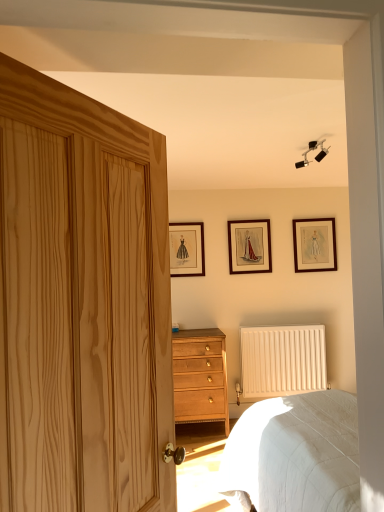
Question: Is natural wood door at left not inside white matte radiator at lower center?

Choices:
 (A) yes
 (B) no

Answer: (A)

Question: Does natural wood door at left have a greater width compared to white matte radiator at lower center?

Choices:
 (A) no
 (B) yes

Answer: (B)

Question: Is natural wood door at left at the right side of white matte radiator at lower center?

Choices:
 (A) yes
 (B) no

Answer: (B)

Question: Is natural wood door at left at the left side of white matte radiator at lower center?

Choices:
 (A) yes
 (B) no

Answer: (A)

Question: Is natural wood door at left further to camera compared to white matte radiator at lower center?

Choices:
 (A) no
 (B) yes

Answer: (A)

Question: From the image's perspective, is natural wood door at left on top of white matte radiator at lower center?

Choices:
 (A) no
 (B) yes

Answer: (B)

Question: Is wooden picture frame at upper right, the third picture frame from the left, closer to camera compared to black matte track light at upper center?

Choices:
 (A) yes
 (B) no

Answer: (B)

Question: Considering the relative sizes of wooden picture frame at upper right, the first picture frame from the right, and black matte track light at upper center in the image provided, is wooden picture frame at upper right, the first picture frame from the right, bigger than black matte track light at upper center?

Choices:
 (A) yes
 (B) no

Answer: (A)

Question: Does wooden picture frame at upper right, the third picture frame from the left, turn towards black matte track light at upper center?

Choices:
 (A) no
 (B) yes

Answer: (B)

Question: Is wooden picture frame at upper right, the third picture frame from the left, facing away from black matte track light at upper center?

Choices:
 (A) no
 (B) yes

Answer: (A)

Question: Are wooden picture frame at upper right, the first picture frame from the right, and black matte track light at upper center located far from each other?

Choices:
 (A) yes
 (B) no

Answer: (A)

Question: Is wooden picture frame at upper right, the third picture frame from the left, to the left of black matte track light at upper center from the viewer's perspective?

Choices:
 (A) no
 (B) yes

Answer: (A)

Question: From the image's perspective, is wooden picture frame at upper right, the third picture frame from the left, beneath white quilted bed at lower right?

Choices:
 (A) yes
 (B) no

Answer: (B)